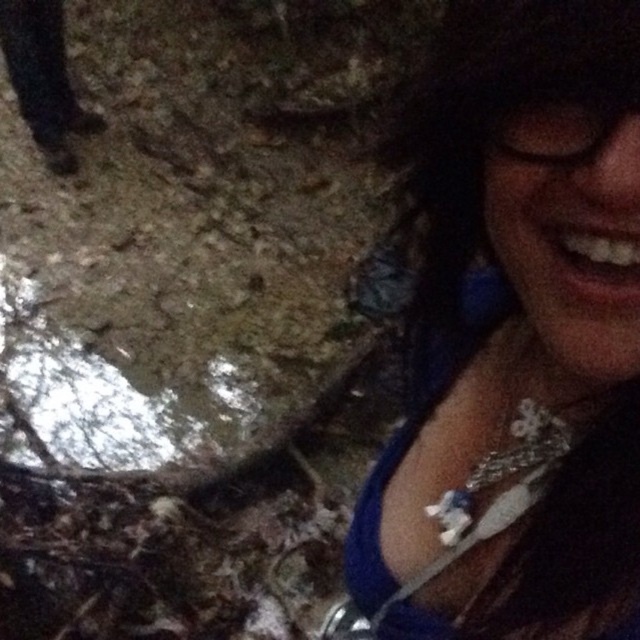
Question: In this image, where is blue fabric necklace at upper right located relative to transparent plastic goggles at upper right?

Choices:
 (A) left
 (B) right

Answer: (A)

Question: Among these points, which one is farthest from the camera?

Choices:
 (A) (600, 84)
 (B) (552, 548)

Answer: (B)

Question: Can you confirm if blue fabric necklace at upper right is smaller than transparent plastic goggles at upper right?

Choices:
 (A) no
 (B) yes

Answer: (A)

Question: Can you confirm if blue fabric necklace at upper right is bigger than transparent plastic goggles at upper right?

Choices:
 (A) yes
 (B) no

Answer: (A)